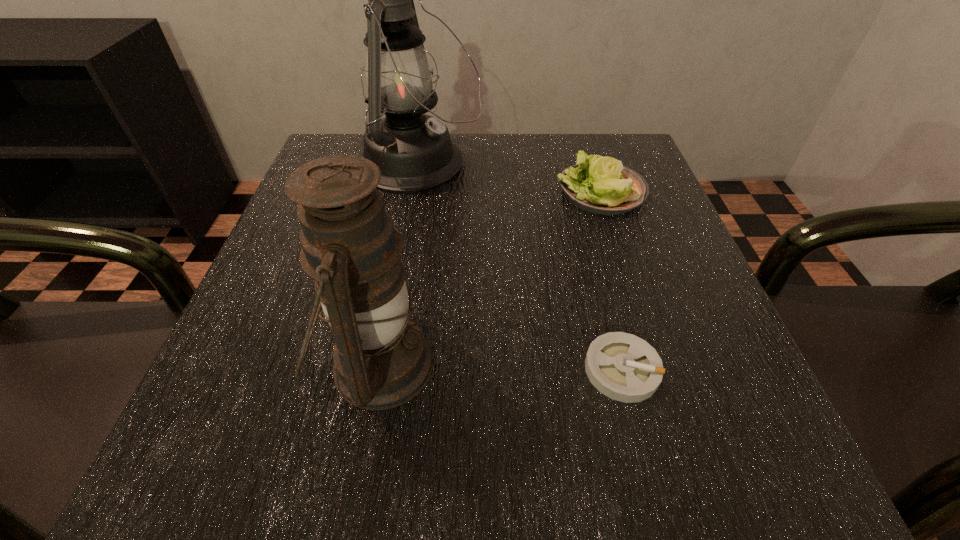
The width and height of the screenshot is (960, 540). Identify the location of blank region between the taller oil lamp and the lettuce. (510, 178).

At what (x,y) coordinates should I click in order to perform the action: click on empty space between the lettuce and the taller oil lamp. Please return your answer as a coordinate pair (x, y). The image size is (960, 540). Looking at the image, I should click on (510, 178).

Where is `vacant space that's between the third tallest object and the tallest object`? vacant space that's between the third tallest object and the tallest object is located at coordinates (510, 178).

Where is `object that stands as the closest to the farther oil lamp`? The image size is (960, 540). object that stands as the closest to the farther oil lamp is located at coordinates (601, 185).

This screenshot has height=540, width=960. What are the coordinates of `object that is the nearest to the taller oil lamp` in the screenshot? It's located at (601, 185).

Locate an element on the screen. vacant space that satisfies the following two spatial constraints: 1. on the front side of the shortest object; 2. on the right side of the taller oil lamp is located at coordinates (383, 369).

The height and width of the screenshot is (540, 960). I want to click on blank area in the image that satisfies the following two spatial constraints: 1. on the front side of the ashtray; 2. on the right side of the shorter oil lamp, so click(377, 369).